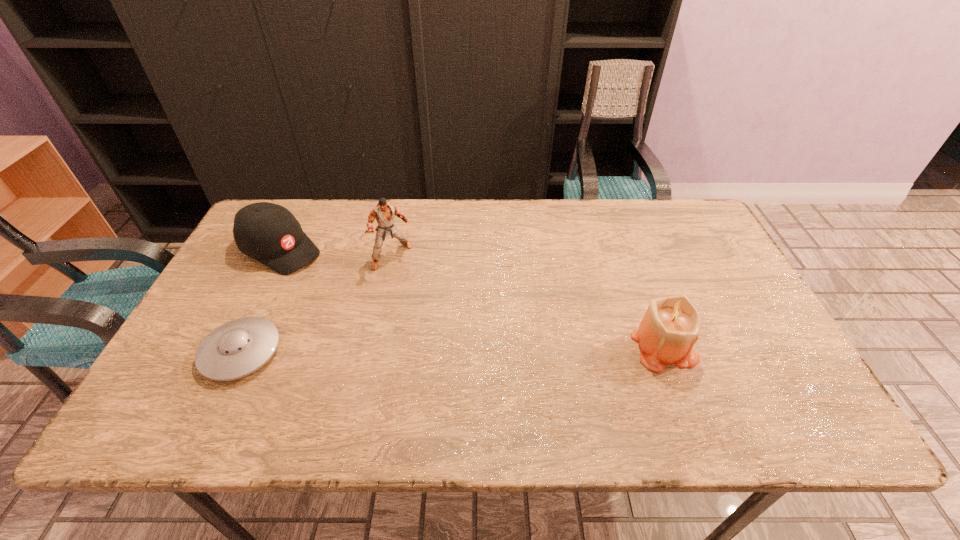
Locate an element on the screen. Image resolution: width=960 pixels, height=540 pixels. blank area in the image that satisfies the following two spatial constraints: 1. on the back side of the second object from right to left; 2. on the left side of the shortest object is located at coordinates (287, 256).